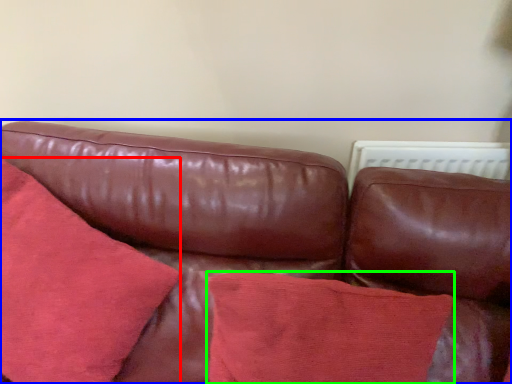
Question: Which is nearer to the throw pillow (highlighted by a red box)? studio couch (highlighted by a blue box) or throw pillow (highlighted by a green box).

Choices:
 (A) studio couch
 (B) throw pillow

Answer: (A)